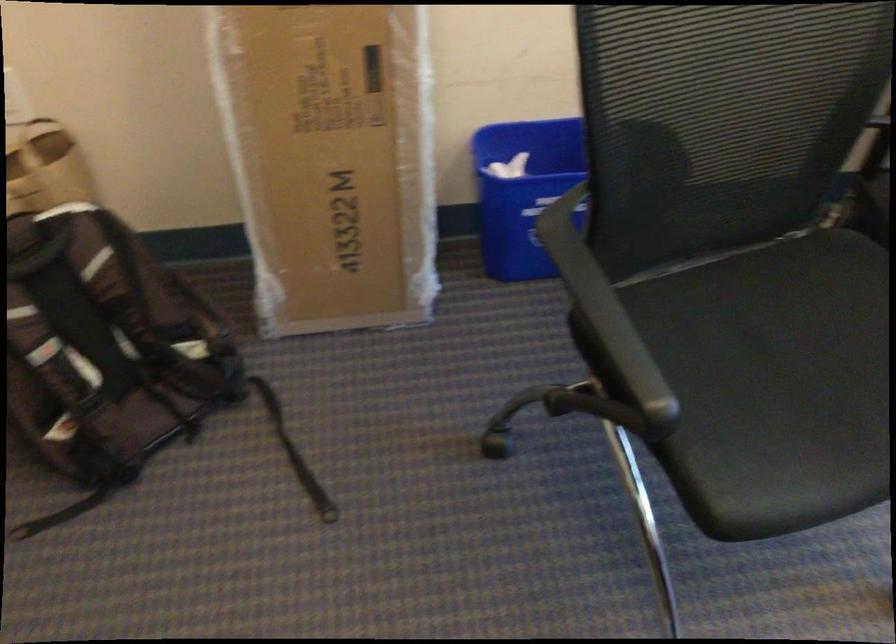
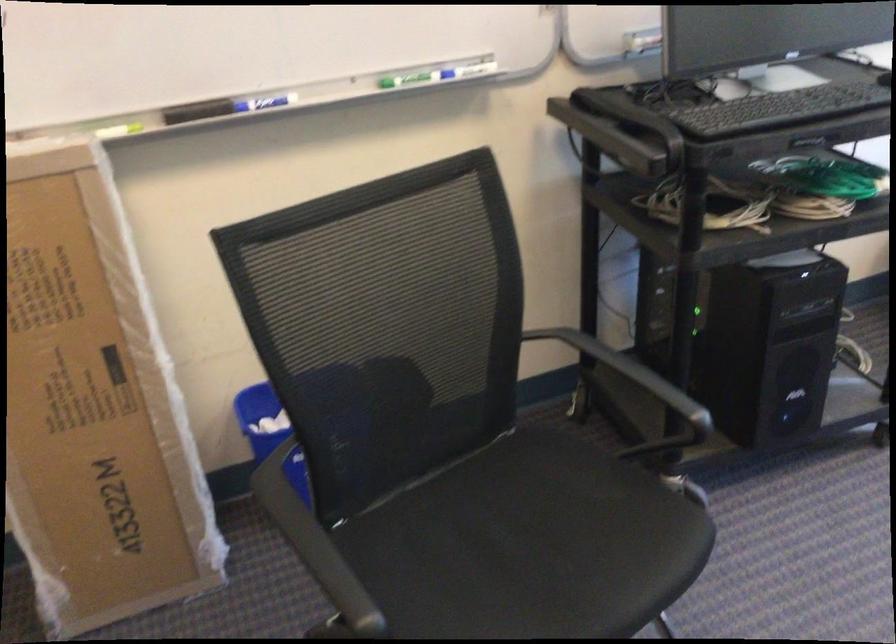
Where in the second image is the point corresponding to (x=820, y=366) from the first image?

(530, 545)